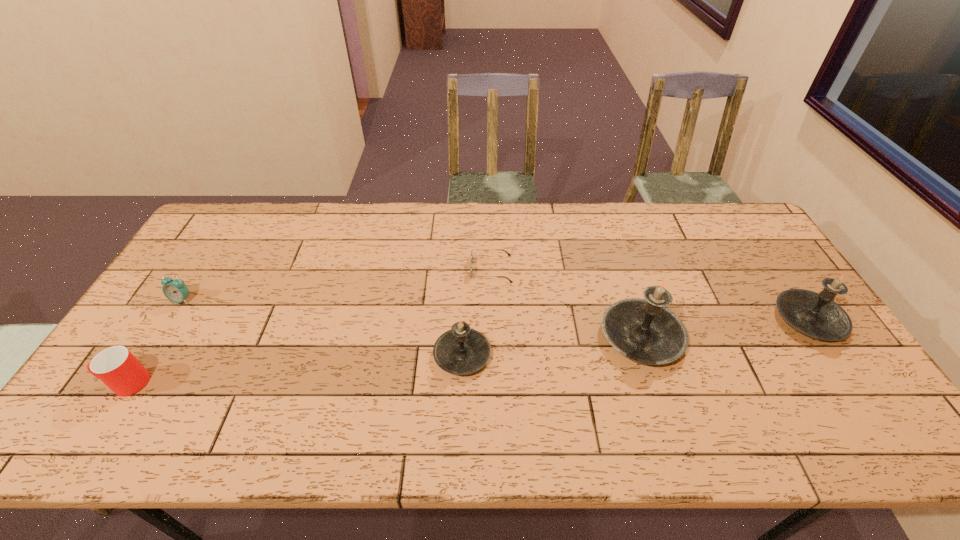
Considering the uniform spacing of candles, where should an additional candle be positioned on the left? Please locate a free spot. Please provide its 2D coordinates. Your answer should be formatted as a tuple, i.e. [(x, y)], where the tuple contains the x and y coordinates of a point satisfying the conditions above.

[(269, 375)]